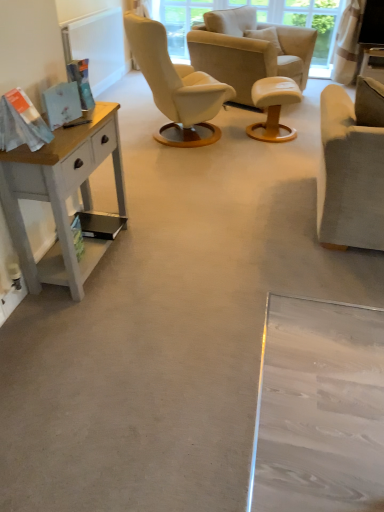
What do you see at coordinates (61, 195) in the screenshot? Image resolution: width=384 pixels, height=512 pixels. I see `white painted wood desk at left` at bounding box center [61, 195].

Describe the element at coordinates (373, 63) in the screenshot. I see `matte white side table at upper right` at that location.

What is the approximate width of white leather stool at center?

white leather stool at center is 18.01 inches wide.

Locate an element on the screen. This screenshot has width=384, height=512. suede beige armchair at center, the first chair when ordered from top to bottom is located at coordinates (249, 50).

Locate an element on the screen. The image size is (384, 512). white painted wood desk at left is located at coordinates (61, 195).

Identify the location of stool above the matte white side table at upper right (from a real-world perspective). The height and width of the screenshot is (512, 384). (273, 108).

Is matte white side table at upper right placed right next to white leather stool at center?

No, matte white side table at upper right is not touching white leather stool at center.

From a real-world perspective, is matte white side table at upper right under white leather stool at center?

Indeed, from a real-world perspective, matte white side table at upper right is positioned beneath white leather stool at center.

Considering the sizes of objects matte white side table at upper right and white leather stool at center in the image provided, who is bigger, matte white side table at upper right or white leather stool at center?

white leather stool at center is bigger.

Can we say white leather stool at center lies outside matte white side table at upper right?

Absolutely, white leather stool at center is external to matte white side table at upper right.

Is white leather stool at center thinner than matte white side table at upper right?

Incorrect, the width of white leather stool at center is not less than that of matte white side table at upper right.

Where is `side table to the right of white leather stool at center`? The height and width of the screenshot is (512, 384). side table to the right of white leather stool at center is located at coordinates (373, 63).

Does white leather stool at center contain white painted wood desk at left?

No, white painted wood desk at left is not surrounded by white leather stool at center.

Looking at the image, does white leather stool at center seem bigger or smaller compared to white painted wood desk at left?

white leather stool at center is smaller than white painted wood desk at left.

Is white leather stool at center positioned far away from white painted wood desk at left?

white leather stool at center is far away from white painted wood desk at left.

Can you tell me how much white painted wood desk at left and suede beige armchair at right, the first chair viewed from the front, differ in facing direction?

41.2 degrees.

Is white painted wood desk at left outside of suede beige armchair at right, the 1th chair in the bottom-to-top sequence?

Indeed, white painted wood desk at left is completely outside suede beige armchair at right, the 1th chair in the bottom-to-top sequence.

From their relative heights in the image, would you say white painted wood desk at left is taller or shorter than suede beige armchair at right, placed as the 2th chair when sorted from back to front?

white painted wood desk at left is shorter than suede beige armchair at right, placed as the 2th chair when sorted from back to front.

Looking at this image, considering the positions of objects suede beige armchair at center, the first chair when ordered from top to bottom, and matte white side table at upper right in the image provided, who is more to the right, suede beige armchair at center, the first chair when ordered from top to bottom, or matte white side table at upper right?

From the viewer's perspective, matte white side table at upper right appears more on the right side.

From the image's perspective, which is below, suede beige armchair at center, the first chair when ordered from top to bottom, or matte white side table at upper right?

From the image's view, suede beige armchair at center, the first chair when ordered from top to bottom, is below.

Is suede beige armchair at center, which is the 1th chair from back to front, thinner than matte white side table at upper right?

In fact, suede beige armchair at center, which is the 1th chair from back to front, might be wider than matte white side table at upper right.

Is suede beige armchair at center, which is the 1th chair from back to front, with matte white side table at upper right?

No.

Considering their positions, is white leather stool at center located in front of or behind suede beige armchair at center, acting as the second chair starting from the bottom?

Visually, white leather stool at center is located in front of suede beige armchair at center, acting as the second chair starting from the bottom.

Which is correct: white leather stool at center is inside suede beige armchair at center, which is the 1th chair from back to front, or outside of it?

white leather stool at center is spatially situated outside suede beige armchair at center, which is the 1th chair from back to front.

Is white leather stool at center to the right of suede beige armchair at center, acting as the second chair starting from the bottom, from the viewer's perspective?

Yes, white leather stool at center is to the right of suede beige armchair at center, acting as the second chair starting from the bottom.

Considering the relative sizes of white leather stool at center and suede beige armchair at right, the second chair in the top-to-bottom sequence, in the image provided, is white leather stool at center taller than suede beige armchair at right, the second chair in the top-to-bottom sequence,?

Incorrect, the height of white leather stool at center is not larger of that of suede beige armchair at right, the second chair in the top-to-bottom sequence.

From a real-world perspective, relative to suede beige armchair at right, placed as the 2th chair when sorted from back to front, is white leather stool at center vertically above or below?

white leather stool at center is situated lower than suede beige armchair at right, placed as the 2th chair when sorted from back to front, in the real world.

From the image's perspective, is white leather stool at center under suede beige armchair at right, the second chair in the top-to-bottom sequence?

Actually, white leather stool at center appears above suede beige armchair at right, the second chair in the top-to-bottom sequence, in the image.

Is suede beige armchair at right, placed as the 2th chair when sorted from back to front, at the back of white leather stool at center?

No, white leather stool at center is not facing the opposite direction of suede beige armchair at right, placed as the 2th chair when sorted from back to front.

Where is `stool located on the left of matte white side table at upper right`? The width and height of the screenshot is (384, 512). stool located on the left of matte white side table at upper right is located at coordinates (273, 108).

At what (x,y) coordinates should I click in order to perform the action: click on side table on the right of the white leather stool at center. Please return your answer as a coordinate pair (x, y). This screenshot has width=384, height=512. Looking at the image, I should click on (373, 63).

From the image, which object appears to be farther from matte white side table at upper right, suede beige armchair at right, placed as the 2th chair when sorted from back to front, or suede beige armchair at center, which appears as the 2th chair when viewed from the front?

suede beige armchair at center, which appears as the 2th chair when viewed from the front, lies further to matte white side table at upper right than the other object.

Based on the photo, which object lies nearer to the anchor point matte white side table at upper right, white leather stool at center or white painted wood desk at left?

Based on the image, white leather stool at center appears to be nearer to matte white side table at upper right.

Considering their positions, is matte white side table at upper right positioned further to suede beige armchair at center, which appears as the 2th chair when viewed from the front, than suede beige armchair at right, the first chair viewed from the front?

The object further to suede beige armchair at center, which appears as the 2th chair when viewed from the front, is suede beige armchair at right, the first chair viewed from the front.

Which object lies nearer to the anchor point white leather stool at center, suede beige armchair at center, which is the 1th chair from back to front, or suede beige armchair at right, placed as the 2th chair when sorted from back to front?

Based on the image, suede beige armchair at center, which is the 1th chair from back to front, appears to be nearer to white leather stool at center.

When comparing their distances from matte white side table at upper right, does white painted wood desk at left or suede beige armchair at right, placed as the 2th chair when sorted from back to front, seem further?

The object further to matte white side table at upper right is white painted wood desk at left.

When comparing their distances from suede beige armchair at center, acting as the second chair starting from the bottom, does suede beige armchair at right, the first chair viewed from the front, or matte white side table at upper right seem closer?

matte white side table at upper right lies closer to suede beige armchair at center, acting as the second chair starting from the bottom, than the other object.

When comparing their distances from white leather stool at center, does matte white side table at upper right or suede beige armchair at center, which is the 1th chair from back to front, seem further?

matte white side table at upper right is further to white leather stool at center.

Based on their spatial positions, is suede beige armchair at center, the first chair when ordered from top to bottom, or white painted wood desk at left closer to suede beige armchair at right, the first chair viewed from the front?

white painted wood desk at left lies closer to suede beige armchair at right, the first chair viewed from the front, than the other object.

The width and height of the screenshot is (384, 512). What are the coordinates of `stool between suede beige armchair at right, the first chair viewed from the front, and matte white side table at upper right, along the z-axis` in the screenshot? It's located at (273, 108).

Locate an element on the screen. This screenshot has width=384, height=512. stool between suede beige armchair at right, the 1th chair in the bottom-to-top sequence, and suede beige armchair at center, the first chair when ordered from top to bottom, from front to back is located at coordinates (273, 108).

You are a GUI agent. You are given a task and a screenshot of the screen. Output one action in this format:
    pyautogui.click(x=<x>, y=<y>)
    Task: Click on the stool between white painted wood desk at left and matte white side table at upper right in the front-back direction
    This screenshot has height=512, width=384.
    Given the screenshot: What is the action you would take?
    (273, 108)

Locate an element on the screen. This screenshot has height=512, width=384. chair between suede beige armchair at right, placed as the 2th chair when sorted from back to front, and matte white side table at upper right, along the z-axis is located at coordinates (249, 50).